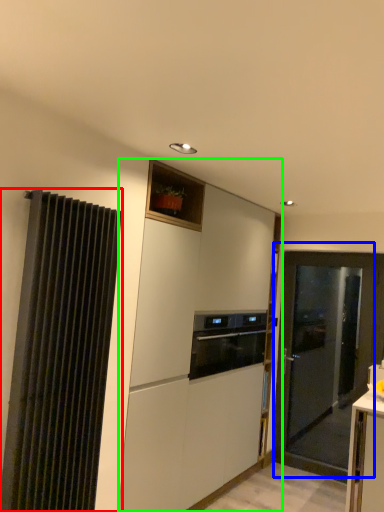
Question: Which object is positioned closest to curtain (highlighted by a red box)? Select from door (highlighted by a blue box) and cabinetry (highlighted by a green box).

Choices:
 (A) door
 (B) cabinetry

Answer: (B)